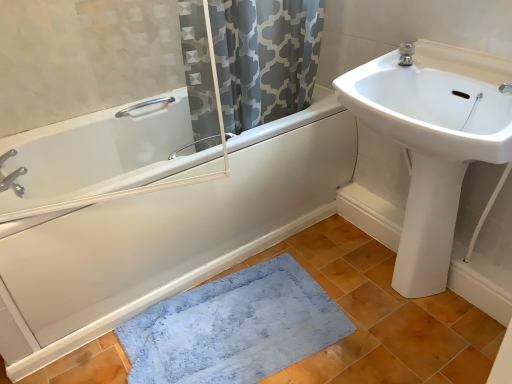
Where is `free spot behind white glossy bidet at right`? free spot behind white glossy bidet at right is located at coordinates (373, 258).